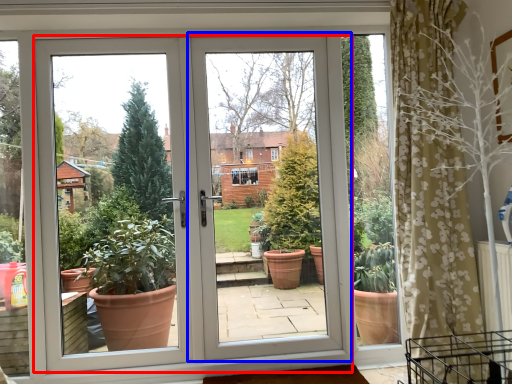
Question: Which object is closer to the camera taking this photo, door (highlighted by a red box) or screen door (highlighted by a blue box)?

Choices:
 (A) door
 (B) screen door

Answer: (A)